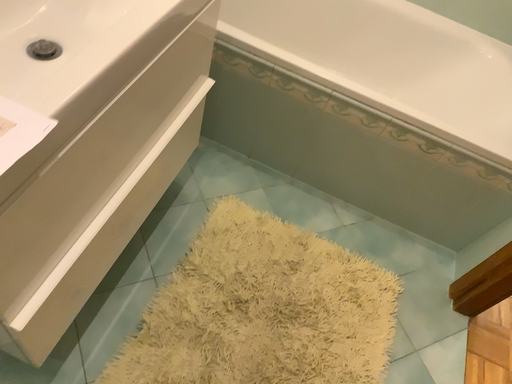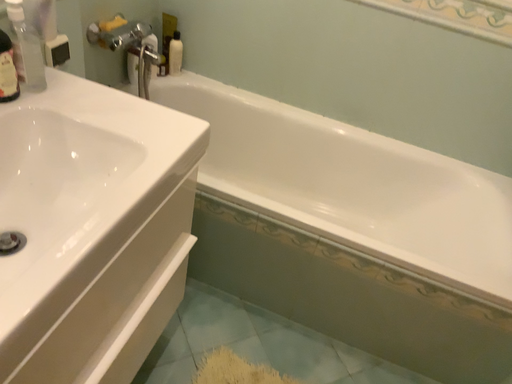
Question: Which way did the camera rotate in the video?

Choices:
 (A) rotated upward
 (B) rotated downward

Answer: (A)